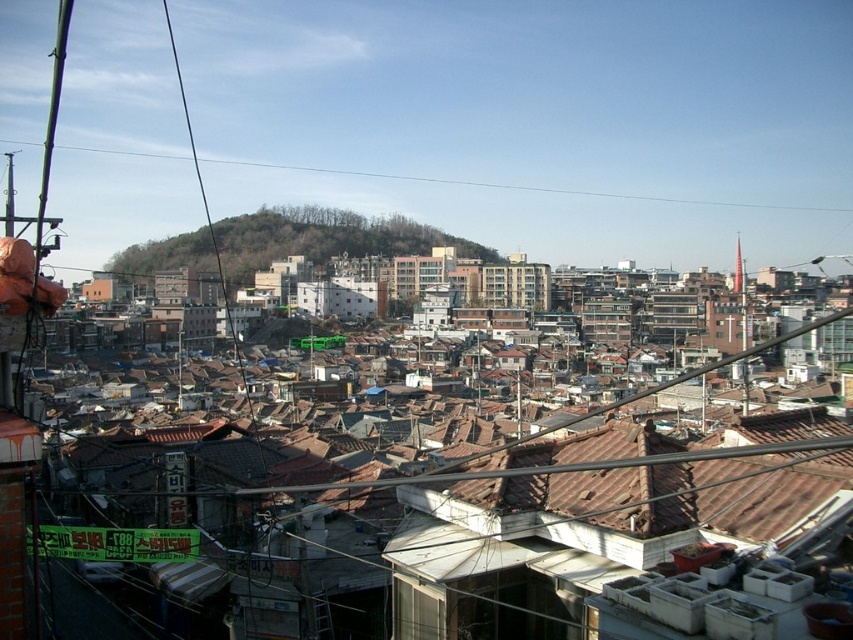
Who is positioned more to the right, green grassy hillside at center or black wire at upper left?

From the viewer's perspective, black wire at upper left appears more on the right side.

Between point (386, 248) and point (572, 195), which one is positioned in front?

Point (386, 248) is in front.

Describe the element at coordinates (326, 237) in the screenshot. The width and height of the screenshot is (853, 640). I see `green grassy hillside at center` at that location.

Identify the location of green grassy hillside at center. (326, 237).